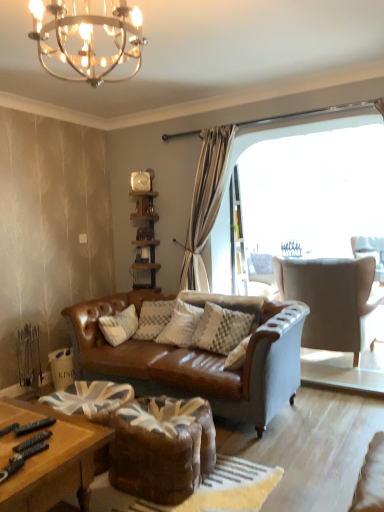
Where is `free location to the right of leather swivel chair at center`? The height and width of the screenshot is (512, 384). free location to the right of leather swivel chair at center is located at coordinates (250, 469).